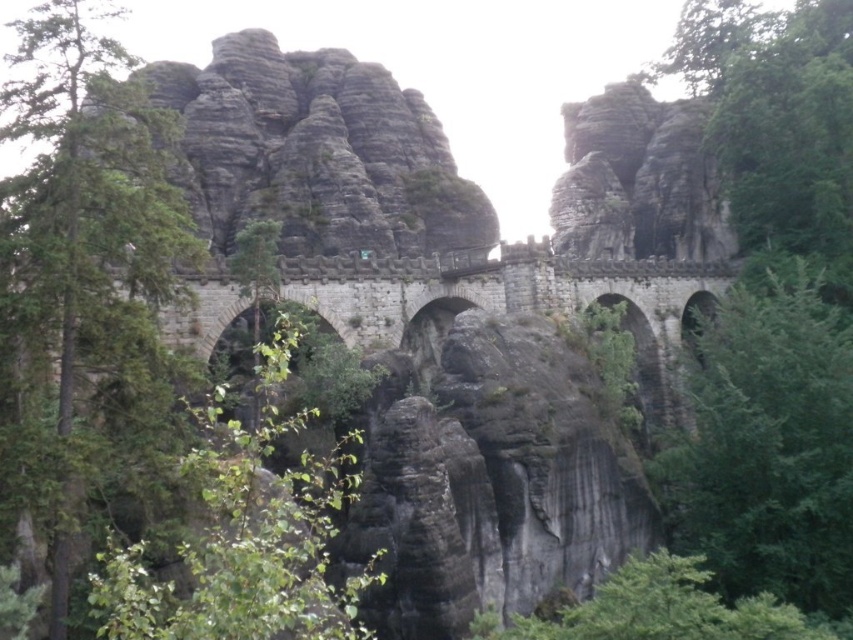
Is rugged stone mountain at center positioned at the back of green leafy tree at right?

No, rugged stone mountain at center is closer to the viewer.

The height and width of the screenshot is (640, 853). Find the location of `rugged stone mountain at center`. rugged stone mountain at center is located at coordinates (316, 154).

The height and width of the screenshot is (640, 853). I want to click on rugged stone mountain at center, so click(316, 154).

Does point (361, 216) lie in front of point (648, 605)?

No, it is behind (648, 605).

Measure the distance between point (357, 189) and camera.

A distance of 101.93 meters exists between point (357, 189) and camera.

Is point (166, 86) farther from camera compared to point (607, 580)?

Yes, point (166, 86) is farther from viewer.

Image resolution: width=853 pixels, height=640 pixels. I want to click on rugged stone mountain at center, so click(316, 154).

How far apart are green leafy tree at left and green leafy tree at lower center?

85.37 feet

Can you confirm if green leafy tree at left is wider than green leafy tree at lower center?

Correct, the width of green leafy tree at left exceeds that of green leafy tree at lower center.

Image resolution: width=853 pixels, height=640 pixels. I want to click on green leafy tree at left, so coord(86,300).